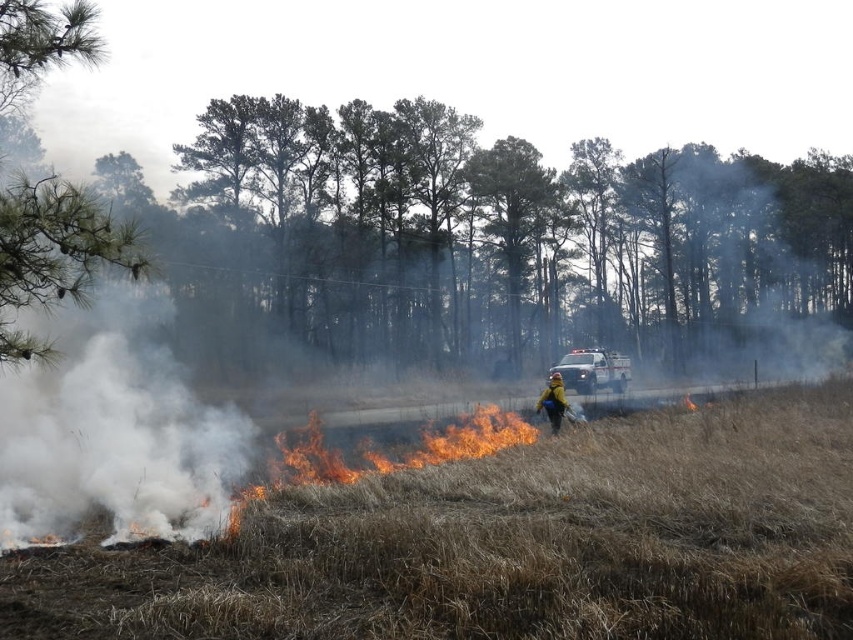
Between point (279, 628) and point (558, 413), which one is positioned behind?

The point (558, 413) is more distant.

The width and height of the screenshot is (853, 640). What do you see at coordinates (509, 545) in the screenshot?
I see `brown dry grass at center` at bounding box center [509, 545].

Between point (76, 576) and point (564, 410), which one is positioned behind?

The point (564, 410) is behind.

The width and height of the screenshot is (853, 640). Identify the location of brown dry grass at center. (509, 545).

Who is lower down, white glossy ambulance at center or yellow-green reflective jacket at center?

Positioned lower is yellow-green reflective jacket at center.

Can you confirm if white glossy ambulance at center is shorter than yellow-green reflective jacket at center?

In fact, white glossy ambulance at center may be taller than yellow-green reflective jacket at center.

This screenshot has width=853, height=640. What are the coordinates of `white glossy ambulance at center` in the screenshot? It's located at (593, 371).

Find the location of a particular element. The width and height of the screenshot is (853, 640). white glossy ambulance at center is located at coordinates (593, 371).

Can you confirm if brown dry grass at center is taller than white glossy ambulance at center?

No, brown dry grass at center is not taller than white glossy ambulance at center.

Where is `brown dry grass at center`? Image resolution: width=853 pixels, height=640 pixels. brown dry grass at center is located at coordinates (509, 545).